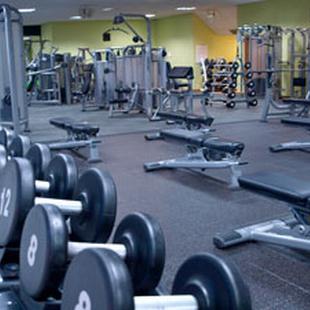
Where is `lights`? This screenshot has width=310, height=310. lights is located at coordinates (76, 16), (26, 37), (26, 8), (150, 16), (188, 7).